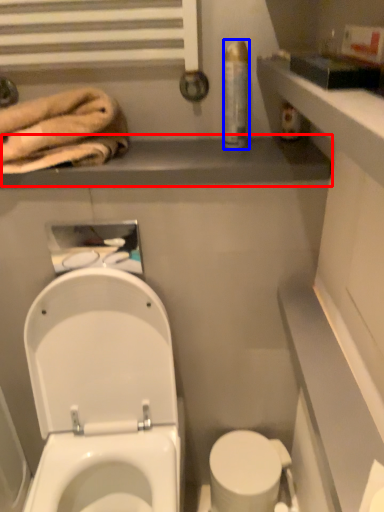
Question: Which object appears closest to the camera in this image, balustrade (highlighted by a red box) or toiletry (highlighted by a blue box)?

Choices:
 (A) balustrade
 (B) toiletry

Answer: (A)